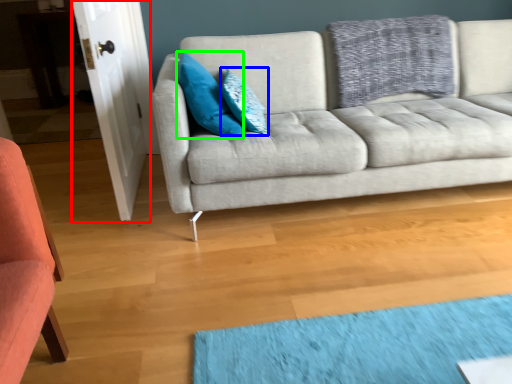
Question: Estimate the real-world distances between objects in this image. Which object is farther from door (highlighted by a red box), pillow (highlighted by a blue box) or pillow (highlighted by a green box)?

Choices:
 (A) pillow
 (B) pillow

Answer: (A)